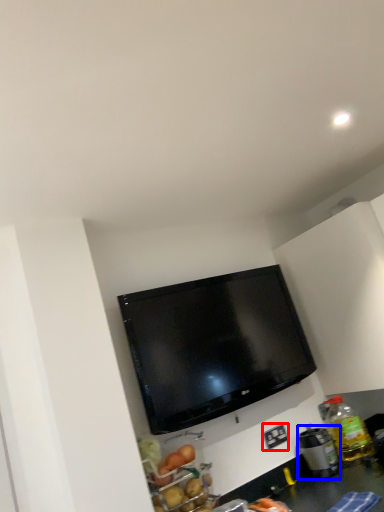
Question: Which point is closer to the camera, electric outlet (highlighted by a red box) or appliance (highlighted by a blue box)?

Choices:
 (A) electric outlet
 (B) appliance

Answer: (B)